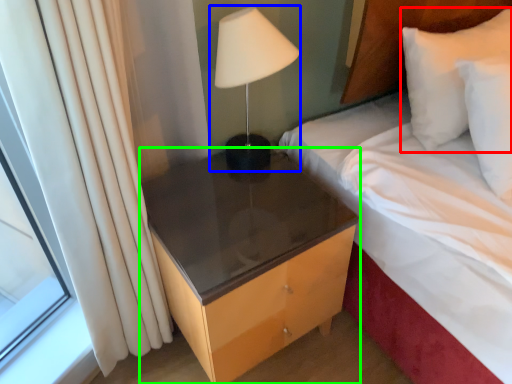
Question: Considering the real-world distances, which object is farthest from pillow (highlighted by a red box)? bedside lamp (highlighted by a blue box) or nightstand (highlighted by a green box)?

Choices:
 (A) bedside lamp
 (B) nightstand

Answer: (B)